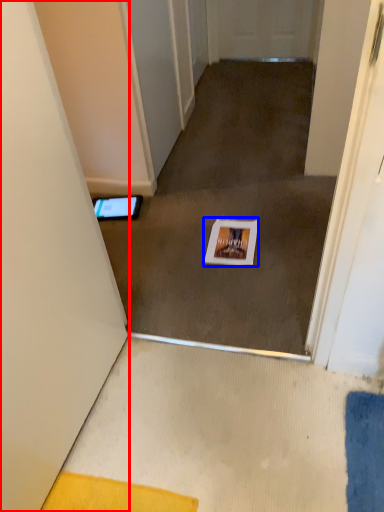
Question: Which point is closer to the camera, door (highlighted by a red box) or postcard (highlighted by a blue box)?

Choices:
 (A) door
 (B) postcard

Answer: (A)